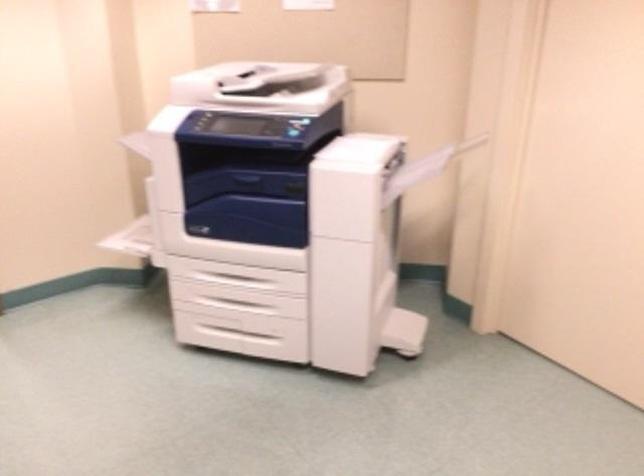
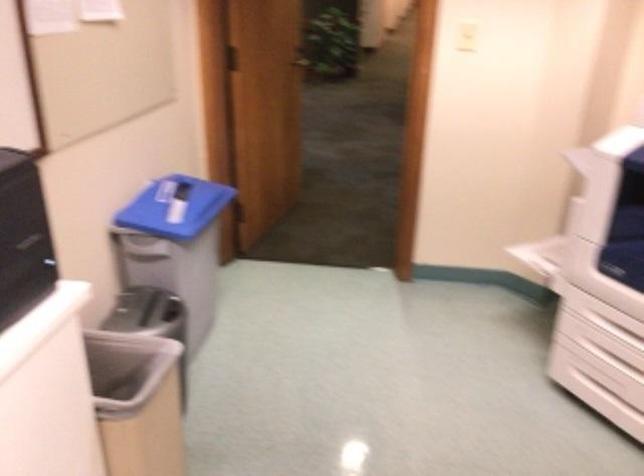
Find the pixel in the second image that matches pixel 214 276 in the first image.

(618, 330)